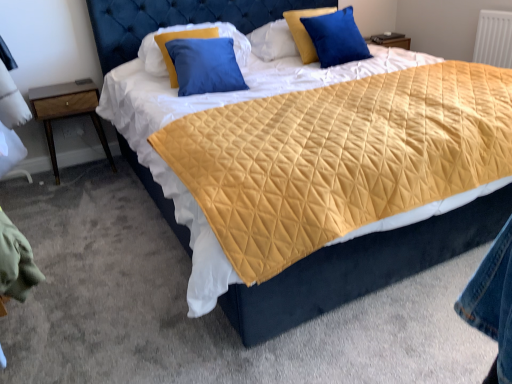
This screenshot has width=512, height=384. Identify the location of vacant space that is to the left of wooden nightstand at left. point(33,178).